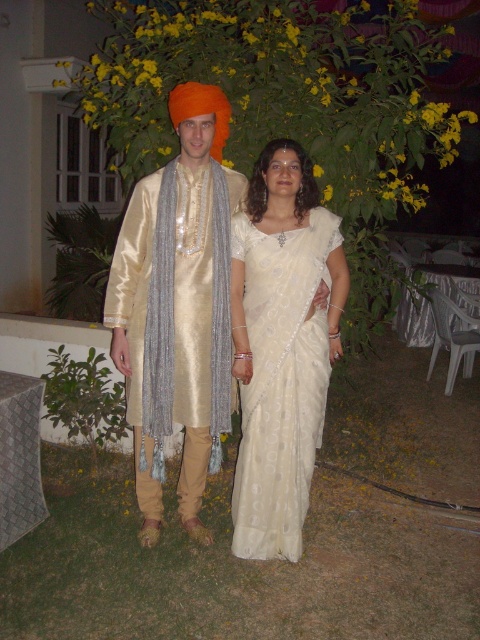
This screenshot has width=480, height=640. Describe the element at coordinates (178, 307) in the screenshot. I see `silky beige kurta at center` at that location.

Between point (207, 138) and point (285, 449), which one is positioned in front?

Positioned in front is point (285, 449).

Does point (182, 477) come behind point (315, 348)?

Yes, it is.

I want to click on silky beige kurta at center, so click(x=178, y=307).